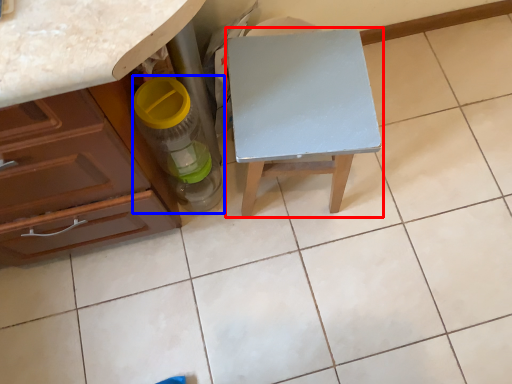
Question: Which point is further to the camera, table (highlighted by a red box) or bottle (highlighted by a blue box)?

Choices:
 (A) table
 (B) bottle

Answer: (A)